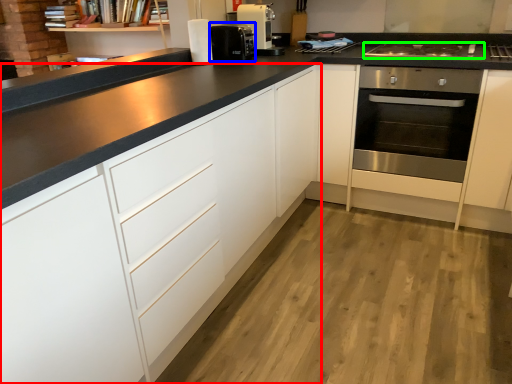
Question: Estimate the real-world distances between objects in this image. Which object is farther from cabinetry (highlighted by a red box), coffee machine (highlighted by a blue box) or gas stove (highlighted by a green box)?

Choices:
 (A) coffee machine
 (B) gas stove

Answer: (B)